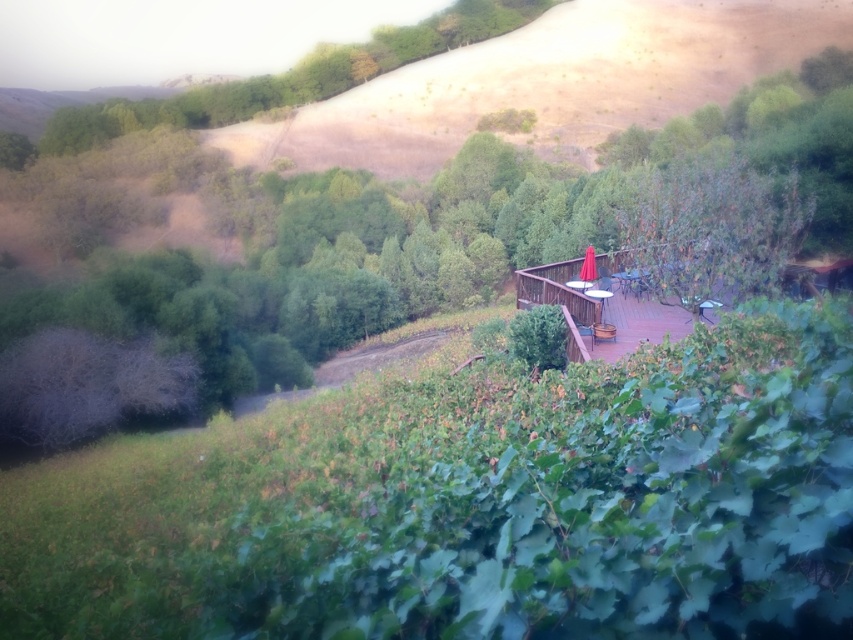
Question: Considering the real-world distances, which object is farthest from the green leafy tree at center?

Choices:
 (A) green leafy tree at upper center
 (B) green leafy tree at upper right

Answer: (A)

Question: Which object is positioned closest to the green leafy tree at center?

Choices:
 (A) green leafy tree at upper center
 (B) green leafy tree at upper right

Answer: (B)

Question: Can you confirm if green leafy tree at upper right is positioned above green leafy tree at upper center?

Choices:
 (A) yes
 (B) no

Answer: (B)

Question: Can you confirm if green leafy tree at upper right is bigger than green leafy tree at upper center?

Choices:
 (A) yes
 (B) no

Answer: (B)

Question: Can you confirm if green leafy tree at center is wider than green leafy tree at upper right?

Choices:
 (A) no
 (B) yes

Answer: (B)

Question: Which of these objects is positioned closest to the green leafy tree at upper right?

Choices:
 (A) green leafy tree at center
 (B) green leafy tree at upper center

Answer: (A)